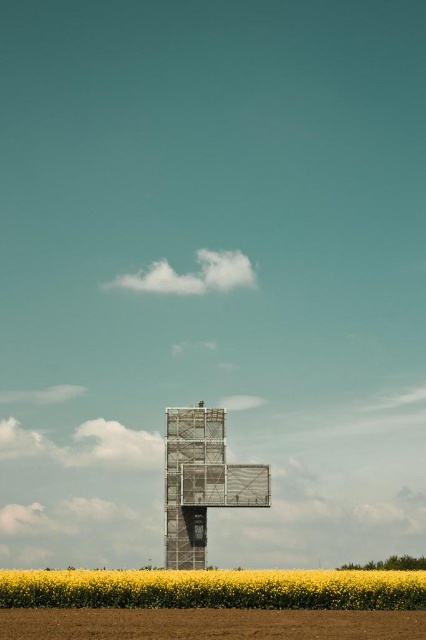
You are a construction worker standing on the ground. You need to determine if you can safely place a 2 meter tall safety barrier between the brown soil at lower center and the scaffolding metal cross at center. Can you do this?

The brown soil at lower center is not as tall as the scaffolding metal cross at center, but since the soil is at lower center and the cross is at center, the vertical space between them allows for placing a 2 meter tall safety barrier.

You are standing at the point marked by the coordinate point (213,588), which corresponds to the yellow matte flower at lower center. Looking towards the large metallic structure in the distance, which direction should you walk to get closer to it?

The yellow matte flower at lower center is at point (213,588). To get closer to the large metallic structure in the distance, you should walk forward since the flower is in the foreground and the structure is in the background, meaning the direction away from the flower leads towards the structure.

You are a photographer standing in the field of yellow flowers. You want to take a photo that includes both the yellow matte flower at lower center and the scaffolding metal cross at center. Which object will appear larger in the photo?

The yellow matte flower at lower center will appear larger in the photo because it is closer to the viewer than the scaffolding metal cross at center.